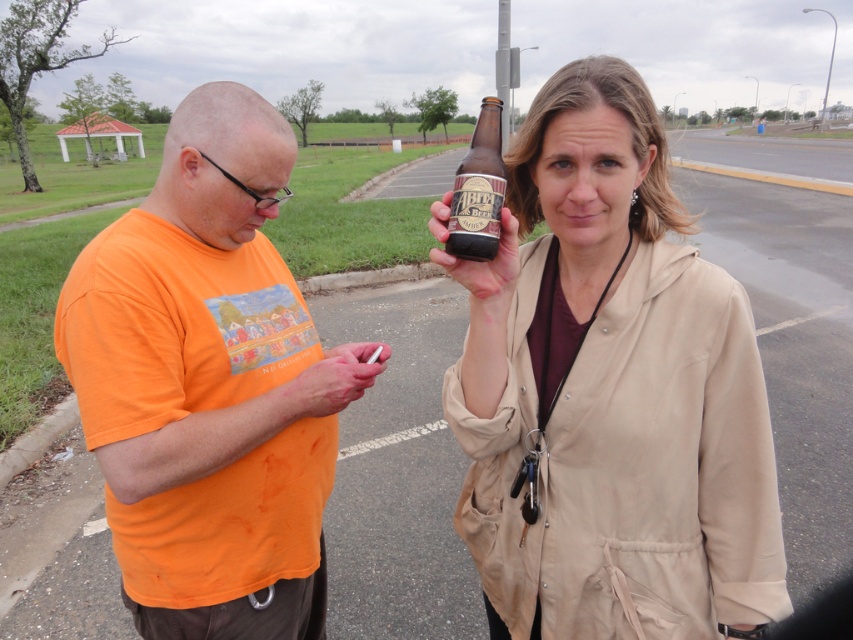
Which is above, matte brown bottle at center or orange cotton shirt at center?

matte brown bottle at center is above.

Between point (480, 509) and point (209, 513), which one is positioned in front?

Point (480, 509)

Is point (633, 435) farther from camera compared to point (91, 246)?

No, it is in front of (91, 246).

Image resolution: width=853 pixels, height=640 pixels. I want to click on matte brown bottle at center, so click(x=611, y=392).

Between matte brown bottle at center and brown glass bottle at center, which one has less height?

With less height is brown glass bottle at center.

Is point (686, 545) in front of point (454, 220)?

No, it is behind (454, 220).

What are the coordinates of `matte brown bottle at center` in the screenshot? It's located at (611, 392).

Identify the location of matte brown bottle at center. (611, 392).

Between orange cotton shirt at center and brown glass bottle at center, which one is positioned higher?

brown glass bottle at center is higher up.

Does orange cotton shirt at center have a greater width compared to brown glass bottle at center?

Correct, the width of orange cotton shirt at center exceeds that of brown glass bottle at center.

This screenshot has width=853, height=640. Describe the element at coordinates (209, 385) in the screenshot. I see `orange cotton shirt at center` at that location.

I want to click on orange cotton shirt at center, so click(x=209, y=385).